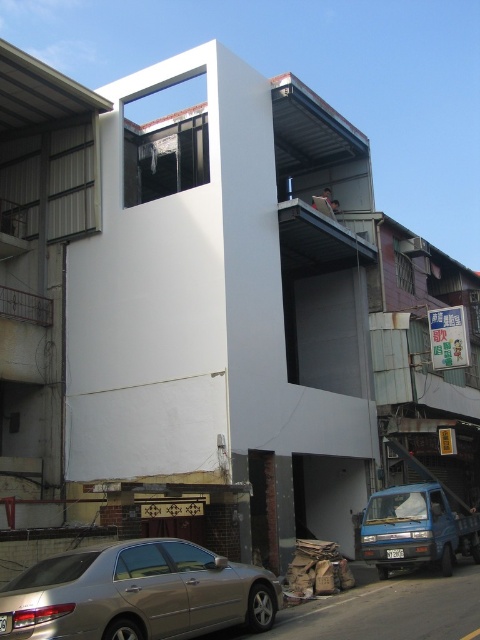
Question: Can you confirm if gold metallic car at lower left is positioned above blue matte van at lower right?

Choices:
 (A) yes
 (B) no

Answer: (A)

Question: Is gold metallic car at lower left positioned in front of blue matte van at lower right?

Choices:
 (A) no
 (B) yes

Answer: (B)

Question: Which of the following is the closest to the observer?

Choices:
 (A) blue matte van at lower right
 (B) gold metallic car at lower left

Answer: (B)

Question: Is gold metallic car at lower left above blue matte van at lower right?

Choices:
 (A) yes
 (B) no

Answer: (A)

Question: Which point is closer to the camera?

Choices:
 (A) gold metallic car at lower left
 (B) blue matte van at lower right

Answer: (A)